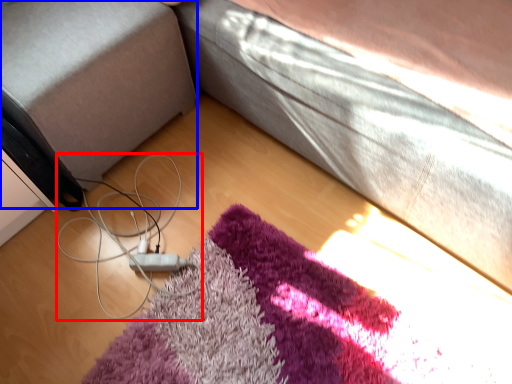
Question: Which point is further to the camera, cable (highlighted by a red box) or gray (highlighted by a blue box)?

Choices:
 (A) cable
 (B) gray

Answer: (A)